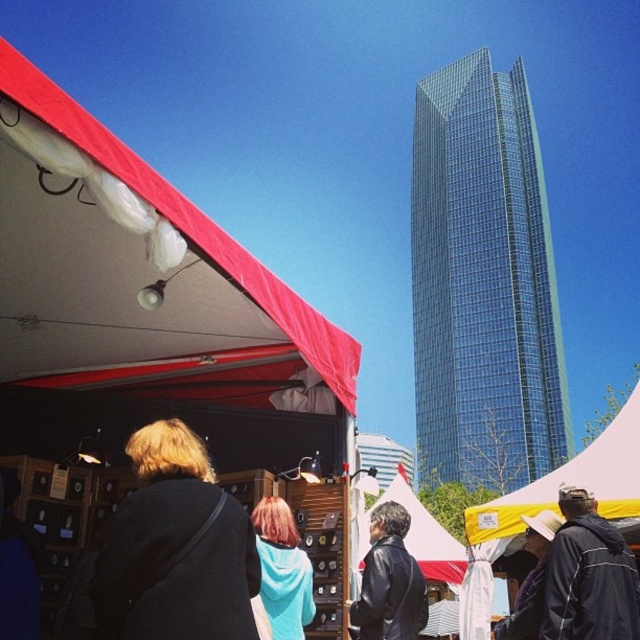
Based on the photo, who is more distant from viewer, (67, 122) or (586, 536)?

The point (586, 536) is more distant.

What do you see at coordinates (188, 224) in the screenshot? I see `white fabric canopy at upper left` at bounding box center [188, 224].

Find the location of a particular element. white fabric canopy at upper left is located at coordinates (188, 224).

Find the location of a particular element. The height and width of the screenshot is (640, 640). dark gray coat at center is located at coordinates (176, 548).

Does point (179, 577) come farther from viewer compared to point (340, 348)?

No, it is in front of (340, 348).

Is point (205, 452) less distant than point (100, 128)?

No, it is not.

I want to click on dark gray coat at center, so click(x=176, y=548).

Is leather jacket at center taller than teal fleece jacket at center?

Yes, leather jacket at center is taller than teal fleece jacket at center.

This screenshot has height=640, width=640. What do you see at coordinates (388, 580) in the screenshot? I see `leather jacket at center` at bounding box center [388, 580].

The height and width of the screenshot is (640, 640). Describe the element at coordinates (388, 580) in the screenshot. I see `leather jacket at center` at that location.

Locate an element on the screen. The width and height of the screenshot is (640, 640). leather jacket at center is located at coordinates point(388,580).